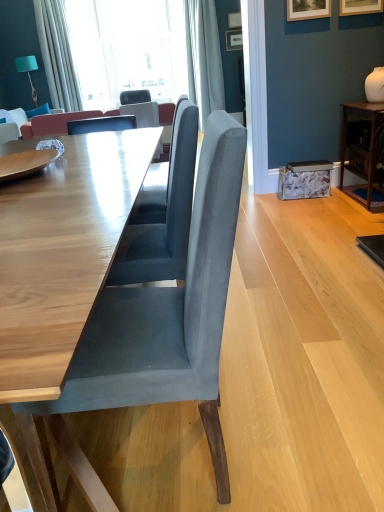
Question: Can you confirm if wooden table at center, placed as the first table when sorted from front to back, is bigger than wooden picture frame at upper center, which is the 1th picture frame in top-to-bottom order?

Choices:
 (A) no
 (B) yes

Answer: (B)

Question: From a real-world perspective, is wooden table at center, which is the 2th table from right to left, positioned under wooden picture frame at upper center, the second picture frame when ordered from back to front, based on gravity?

Choices:
 (A) no
 (B) yes

Answer: (B)

Question: Is wooden table at center, marked as the first table in a left-to-right arrangement, next to wooden picture frame at upper center, the 4th picture frame positioned from the bottom, and touching it?

Choices:
 (A) yes
 (B) no

Answer: (B)

Question: Is wooden table at center, marked as the first table in a left-to-right arrangement, positioned with its back to wooden picture frame at upper center, which is the 1th picture frame in top-to-bottom order?

Choices:
 (A) no
 (B) yes

Answer: (A)

Question: Considering the relative sizes of wooden table at center, which is the 2th table from right to left, and wooden picture frame at upper center, the 4th picture frame positioned from the bottom, in the image provided, is wooden table at center, which is the 2th table from right to left, wider than wooden picture frame at upper center, the 4th picture frame positioned from the bottom,?

Choices:
 (A) yes
 (B) no

Answer: (A)

Question: In terms of height, does wooden picture frame at upper right, which appears as the 2th picture frame when ordered from the bottom, look taller or shorter compared to teal fabric lampshade at upper left?

Choices:
 (A) short
 (B) tall

Answer: (A)

Question: Considering the positions of wooden picture frame at upper right, marked as the 3th picture frame in a top-to-bottom arrangement, and teal fabric lampshade at upper left in the image, is wooden picture frame at upper right, marked as the 3th picture frame in a top-to-bottom arrangement, bigger or smaller than teal fabric lampshade at upper left?

Choices:
 (A) small
 (B) big

Answer: (A)

Question: From a real-world perspective, is wooden picture frame at upper right, marked as the 3th picture frame in a top-to-bottom arrangement, positioned above or below teal fabric lampshade at upper left?

Choices:
 (A) below
 (B) above

Answer: (B)

Question: Considering their positions, is wooden picture frame at upper right, marked as the 3th picture frame in a top-to-bottom arrangement, located in front of or behind teal fabric lampshade at upper left?

Choices:
 (A) behind
 (B) front

Answer: (B)

Question: From the image's perspective, relative to slate gray fabric chair at center, placed as the second chair when sorted from back to front, is wooden picture frame at upper right, the 3th picture frame from the back, above or below?

Choices:
 (A) below
 (B) above

Answer: (B)

Question: Do you think wooden picture frame at upper right, the fourth picture frame when ordered from top to bottom, is within slate gray fabric chair at center, arranged as the 2th chair when viewed from the left, or outside of it?

Choices:
 (A) inside
 (B) outside

Answer: (B)

Question: Is wooden picture frame at upper right, which ranks as the 2th picture frame in front-to-back order, taller or shorter than slate gray fabric chair at center, which is the second chair in bottom-to-top order?

Choices:
 (A) short
 (B) tall

Answer: (B)

Question: Looking at the image, does wooden picture frame at upper right, the 3th picture frame from the back, seem bigger or smaller compared to slate gray fabric chair at center, placed as the second chair when sorted from back to front?

Choices:
 (A) small
 (B) big

Answer: (A)

Question: From a real-world perspective, relative to suede gray chair at center, the third chair in the top-to-bottom sequence, is wooden picture frame at upper center, which is the 1th picture frame in top-to-bottom order, vertically above or below?

Choices:
 (A) above
 (B) below

Answer: (A)

Question: Is wooden picture frame at upper center, which is the 1th picture frame in top-to-bottom order, taller or shorter than suede gray chair at center, which appears as the third chair when viewed from the back?

Choices:
 (A) short
 (B) tall

Answer: (A)